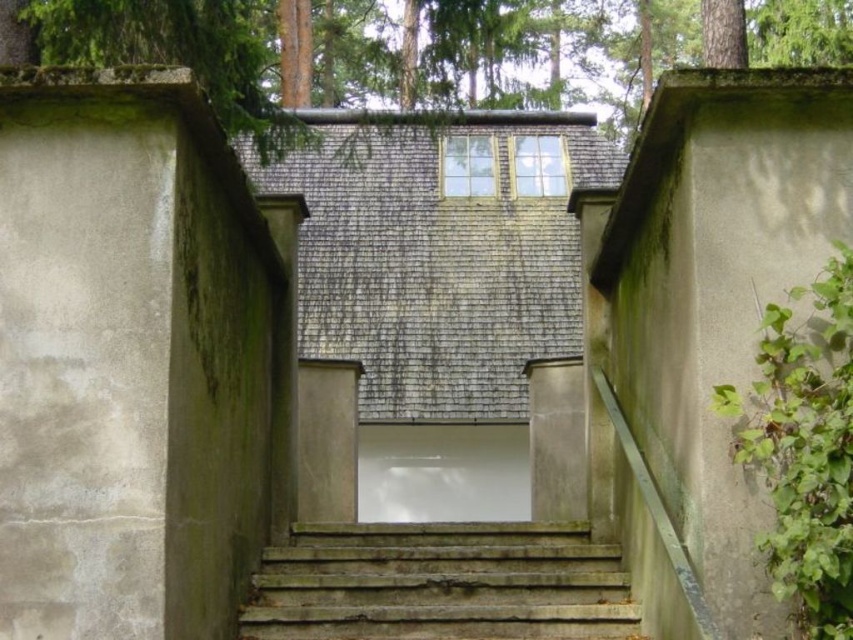
Is green textured tree at upper center to the right of rusty concrete stairs at center from the viewer's perspective?

Yes, green textured tree at upper center is to the right of rusty concrete stairs at center.

Between point (610, 122) and point (282, 557), which one is positioned behind?

Positioned behind is point (610, 122).

The height and width of the screenshot is (640, 853). Find the location of `green textured tree at upper center`. green textured tree at upper center is located at coordinates [422, 51].